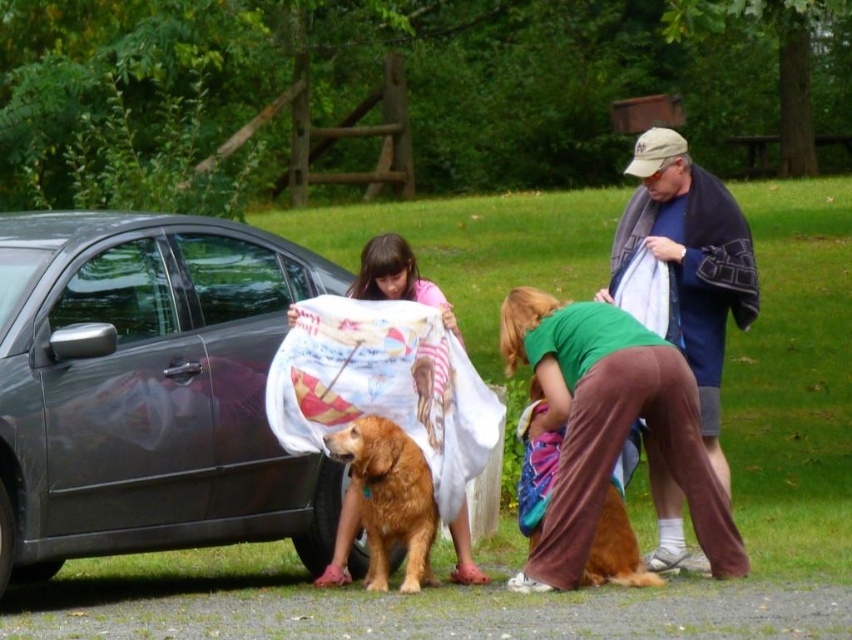
You are standing in the park and want to take a photo of the shiny black car at left. The camera you have can focus on objects up to 10 meters away. Will the car be in focus?

The shiny black car at left is 7.47 meters from viewer, so yes, the car will be in focus since it is within the camera focus range of up to 10 meters.